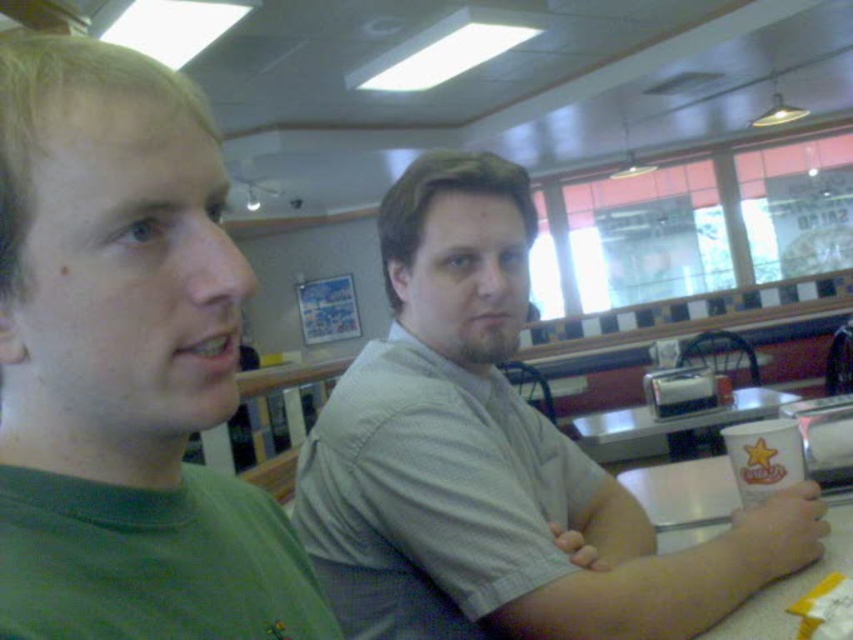
Based on the photo, you are a photographer trying to focus on the two points in the scene. Which point, point (657, 632) or point (756, 605), is closer to your camera?

Point (657, 632) is closer to the camera than point (756, 605).

You are a delivery person who needs to place a small package between the gray textured shirt at center and the white paper cup at right. The package is 2 feet long. Can you fit it between them without moving either object?

The distance between the gray textured shirt at center and the white paper cup at right is 5.57 feet. Since the package is 2 feet long, it can easily fit between them as there is enough space.